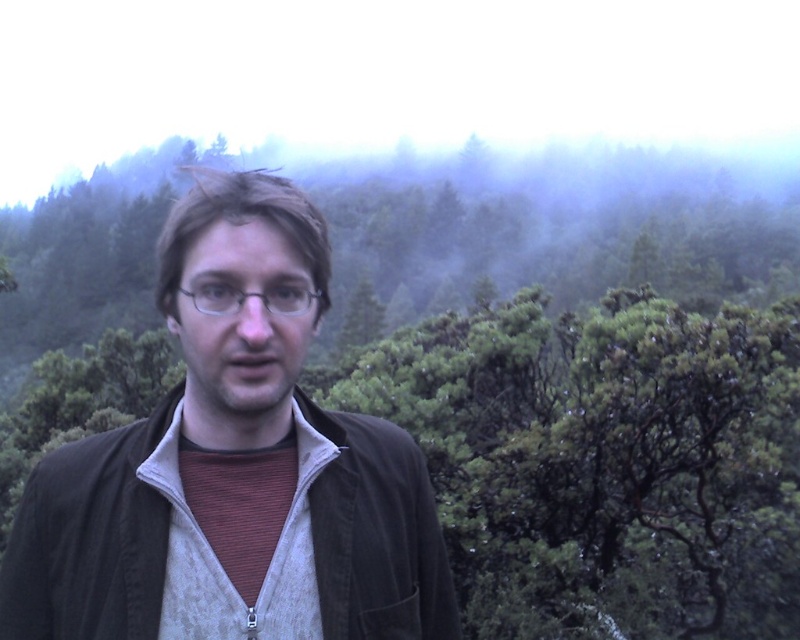
You are a hiker trying to identify the location of your jacket in a forest scene. The jacket is brown and located at point (232, 472). Based on the description, where should you look to find the brown fabric jacket at center?

The point (232, 472) indicates the location of the brown fabric jacket at center, so you should look at the center of the image to find it.

You are a photographer trying to capture the brown fabric jacket at center in the frame. If your camera has a focal point at coordinates 0.5, 0.5, will the jacket be centered in the photo?

The brown fabric jacket at center is located at coordinates (232, 472), which is to the right and slightly below the camera focal point at (400, 320). Therefore, the jacket will not be centered in the photo.